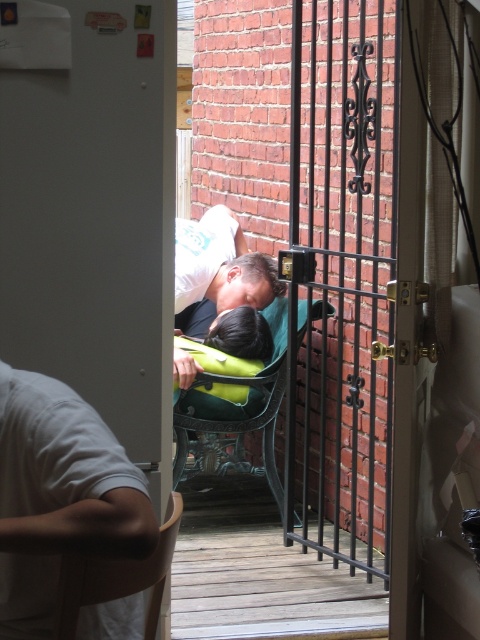
Question: In this image, where is green plastic chair at center located relative to wooden chair at lower left?

Choices:
 (A) below
 (B) above

Answer: (B)

Question: Does green plastic chair at center appear on the right side of matte green backpack at center?

Choices:
 (A) yes
 (B) no

Answer: (A)

Question: Estimate the real-world distances between objects in this image. Which object is farther from the matte green backpack at center?

Choices:
 (A) green plastic chair at center
 (B) white cotton shirt at lower left
 (C) white matte door at upper left

Answer: (B)

Question: Which point is farther from the camera taking this photo?

Choices:
 (A) (120, 401)
 (B) (33, 589)
 (C) (181, 232)
 (D) (72, 612)

Answer: (C)

Question: Is white cotton shirt at lower left smaller than wooden chair at lower left?

Choices:
 (A) no
 (B) yes

Answer: (A)

Question: Which point is farther to the camera?

Choices:
 (A) (131, 10)
 (B) (206, 260)

Answer: (B)